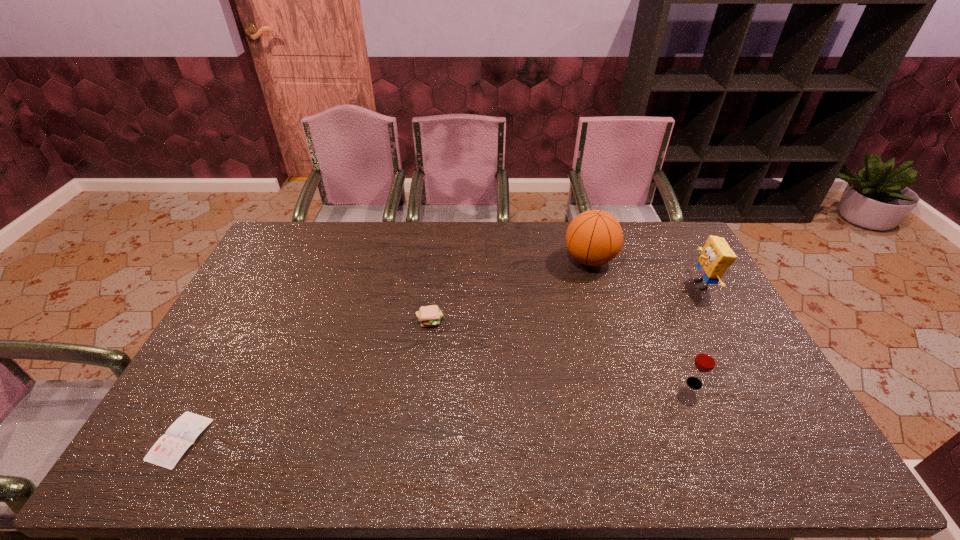
You are a GUI agent. You are given a task and a screenshot of the screen. Output one action in this format:
    pyautogui.click(x=<x>, y=<y>)
    Task: Click on the third object from left to right
    This screenshot has width=960, height=540.
    Given the screenshot: What is the action you would take?
    pyautogui.click(x=593, y=238)

Where is `the fourth shortest object`? This screenshot has width=960, height=540. the fourth shortest object is located at coordinates (716, 257).

Identify the location of sponge. The image size is (960, 540). (716, 257).

Image resolution: width=960 pixels, height=540 pixels. Identify the location of the second nearest object. (705, 361).

This screenshot has width=960, height=540. Find the location of `the fourth object from left to right`. the fourth object from left to right is located at coordinates (705, 361).

Locate an element on the screen. The image size is (960, 540). the second shortest object is located at coordinates (430, 315).

Where is `the fourth object from right to left`? This screenshot has height=540, width=960. the fourth object from right to left is located at coordinates (430, 315).

This screenshot has width=960, height=540. I want to click on diary, so click(166, 452).

Locate an element on the screen. This screenshot has height=540, width=960. the shortest object is located at coordinates (166, 452).

Where is `free location located on the right of the third object from right to left`? free location located on the right of the third object from right to left is located at coordinates (665, 260).